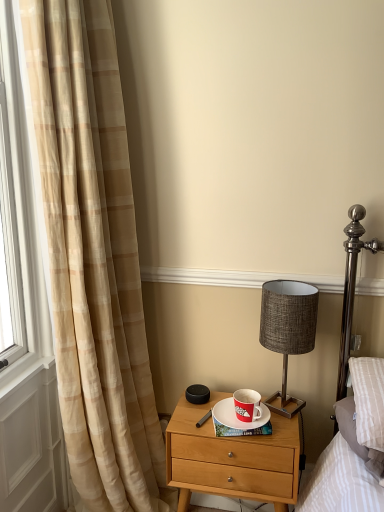
Question: Considering the relative positions of beige plaid curtain at left and metallic gray lampshade at center-right in the image provided, is beige plaid curtain at left in front of metallic gray lampshade at center-right?

Choices:
 (A) no
 (B) yes

Answer: (B)

Question: Is beige plaid curtain at left looking in the opposite direction of metallic gray lampshade at center-right?

Choices:
 (A) no
 (B) yes

Answer: (A)

Question: Is beige plaid curtain at left facing towards metallic gray lampshade at center-right?

Choices:
 (A) yes
 (B) no

Answer: (A)

Question: From the image's perspective, is beige plaid curtain at left below metallic gray lampshade at center-right?

Choices:
 (A) no
 (B) yes

Answer: (A)

Question: Considering the relative sizes of beige plaid curtain at left and metallic gray lampshade at center-right in the image provided, is beige plaid curtain at left shorter than metallic gray lampshade at center-right?

Choices:
 (A) no
 (B) yes

Answer: (A)

Question: Looking at the image, does red matte coffee cup at center seem bigger or smaller compared to wooden nightstand at center?

Choices:
 (A) small
 (B) big

Answer: (A)

Question: Is red matte coffee cup at center wider or thinner than wooden nightstand at center?

Choices:
 (A) wide
 (B) thin

Answer: (B)

Question: From their relative heights in the image, would you say red matte coffee cup at center is taller or shorter than wooden nightstand at center?

Choices:
 (A) short
 (B) tall

Answer: (A)

Question: Based on their positions, is red matte coffee cup at center located to the left or right of wooden nightstand at center?

Choices:
 (A) left
 (B) right

Answer: (B)

Question: Would you say metallic gray lampshade at center-right is inside or outside red matte coffee cup at center?

Choices:
 (A) inside
 (B) outside

Answer: (B)

Question: Does point (x=296, y=338) appear closer or farther from the camera than point (x=259, y=415)?

Choices:
 (A) closer
 (B) farther

Answer: (A)

Question: From their relative heights in the image, would you say metallic gray lampshade at center-right is taller or shorter than red matte coffee cup at center?

Choices:
 (A) short
 (B) tall

Answer: (B)

Question: Looking at their shapes, would you say metallic gray lampshade at center-right is wider or thinner than red matte coffee cup at center?

Choices:
 (A) wide
 (B) thin

Answer: (A)

Question: Would you say red matte coffee cup at center is to the left or to the right of white ceramic saucer at center in the picture?

Choices:
 (A) right
 (B) left

Answer: (A)

Question: Considering the positions of red matte coffee cup at center and white ceramic saucer at center in the image, is red matte coffee cup at center taller or shorter than white ceramic saucer at center?

Choices:
 (A) tall
 (B) short

Answer: (A)